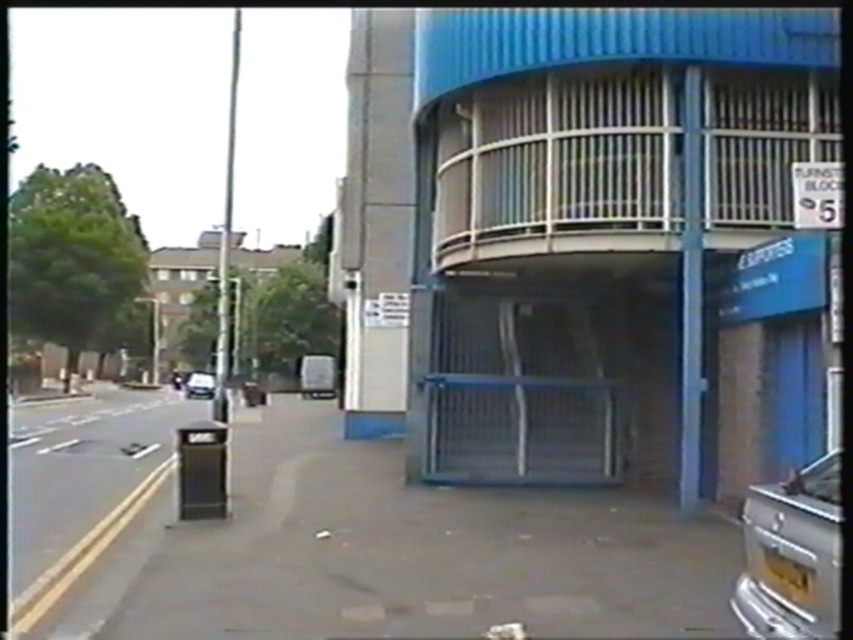
You are a delivery person needing to park your shiny silver car at lower right near the closed metal gate. However, there is another shiny silver car at center blocking the path. Can you safely maneuver around it to reach the gate without crossing the yellow line on the sidewalk?

The shiny silver car at lower right is closer to the viewer than the shiny silver car at center, so you can maneuver around it by driving past the shiny silver car at center since it is further away and not obstructing the path directly in front of you. However, ensure you stay within the road and do not cross the yellow line on the sidewalk.

You are a delivery person who needs to park your shiny silver car at center on the black asphalt pavement at lower left. Can you fit your car on the pavement?

The black asphalt pavement at lower left is bigger than the shiny silver car at center, so yes, the car can fit on the pavement.

You are a delivery person needing to park your shiny silver car at lower right, which is narrower than the other shiny silver car at center. The yellow line on the sidewalk indicates a no parking zone. Can you park your car at the lower right without violating the no parking rule?

The shiny silver car at lower right is narrower than the shiny silver car at center, but the yellow line on the sidewalk indicates a no parking zone. Therefore, you cannot park your car there without violating the no parking rule.